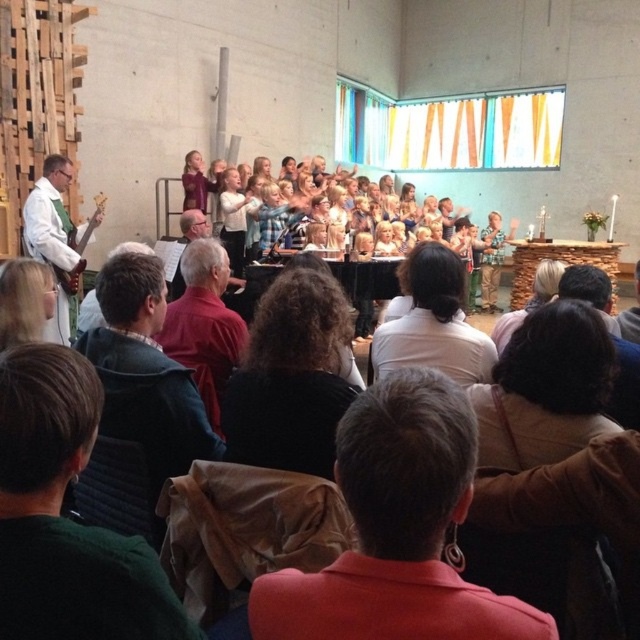
Question: Is green fabric at lower left above light brown hair at center?

Choices:
 (A) no
 (B) yes

Answer: (A)

Question: Can you confirm if green fabric at lower left is positioned to the left of blonde hair at upper left?

Choices:
 (A) yes
 (B) no

Answer: (B)

Question: Can you confirm if white shirt at center is positioned below red shirt at center?

Choices:
 (A) no
 (B) yes

Answer: (B)

Question: Which object is the farthest from the blonde hair at upper left?

Choices:
 (A) green fabric at lower left
 (B) dark brown hair at center
 (C) light brown hair at center

Answer: (C)

Question: Which point is closer to the camera?

Choices:
 (A) (65, 308)
 (B) (624, 326)
 (C) (209, 387)
 (D) (308, 368)

Answer: (D)

Question: Which of the following is the closest to the observer?

Choices:
 (A) (188, 292)
 (B) (336, 316)
 (C) (38, 378)

Answer: (C)